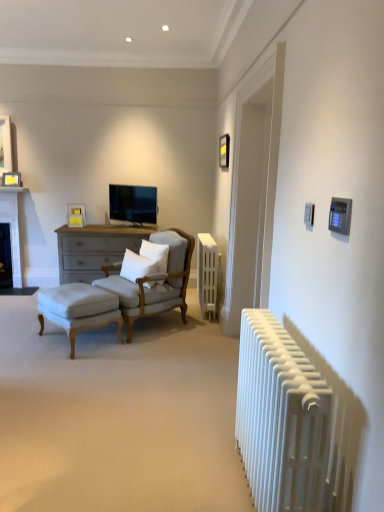
What do you see at coordinates (133, 204) in the screenshot? This screenshot has height=512, width=384. I see `matte black tv at center` at bounding box center [133, 204].

This screenshot has height=512, width=384. Find the location of `white fabric ottoman at lower left`. white fabric ottoman at lower left is located at coordinates (79, 309).

What is the approximate width of matte black picture frame at upper center, positioned as the first picture frame in top-to-bottom order?

1.90 inches.

Image resolution: width=384 pixels, height=512 pixels. What do you see at coordinates (224, 151) in the screenshot?
I see `matte black picture frame at upper center, arranged as the 3th picture frame when viewed from the left` at bounding box center [224, 151].

You are a GUI agent. You are given a task and a screenshot of the screen. Output one action in this format:
    pyautogui.click(x=<x>, y=<y>)
    Task: Click on the matte yellow picture frame at upper left, the 2th picture frame positioned from the bottom
    This screenshot has height=512, width=384.
    Given the screenshot: What is the action you would take?
    pyautogui.click(x=12, y=179)

This screenshot has width=384, height=512. What do you see at coordinates (14, 230) in the screenshot?
I see `white stone fireplace at left, arranged as the 2th fireplace when ordered from the bottom` at bounding box center [14, 230].

Consider the image. Measure the distance between point (145, 252) and camera.

4.01 meters.

What do you see at coordinates (156, 254) in the screenshot? The height and width of the screenshot is (512, 384). I see `white soft pillow at center, the first pillow in the right-to-left sequence` at bounding box center [156, 254].

Find the location of `matte black tv at center`. matte black tv at center is located at coordinates (133, 204).

Is white fabric ottoman at lower left looking in the opposite direction of light beige fabric armchair at center-left?

No, white fabric ottoman at lower left is not facing the opposite direction of light beige fabric armchair at center-left.

Can you confirm if white fabric ottoman at lower left is shorter than light beige fabric armchair at center-left?

Correct, white fabric ottoman at lower left is not as tall as light beige fabric armchair at center-left.

From the image's perspective, is white fabric ottoman at lower left above or below light beige fabric armchair at center-left?

Based on their image positions, white fabric ottoman at lower left is located beneath light beige fabric armchair at center-left.

Which object is thinner, white stone fireplace at left, the first fireplace from the top, or dark gray stone fireplace at left, placed as the 1th fireplace when sorted from bottom to top?

With smaller width is white stone fireplace at left, the first fireplace from the top.

Considering the relative positions of white stone fireplace at left, the first fireplace from the top, and dark gray stone fireplace at left, placed as the 1th fireplace when sorted from bottom to top, in the image provided, is white stone fireplace at left, the first fireplace from the top, to the left or to the right of dark gray stone fireplace at left, placed as the 1th fireplace when sorted from bottom to top,?

white stone fireplace at left, the first fireplace from the top, is to the right of dark gray stone fireplace at left, placed as the 1th fireplace when sorted from bottom to top.

Is white stone fireplace at left, arranged as the 2th fireplace when ordered from the bottom, outside of dark gray stone fireplace at left, placed as the 1th fireplace when sorted from bottom to top?

That's incorrect, white stone fireplace at left, arranged as the 2th fireplace when ordered from the bottom, is not completely outside dark gray stone fireplace at left, placed as the 1th fireplace when sorted from bottom to top.

Consider the image. Is white stone fireplace at left, the first fireplace from the top, beside dark gray stone fireplace at left, placed as the 1th fireplace when sorted from bottom to top?

No, white stone fireplace at left, the first fireplace from the top, is not making contact with dark gray stone fireplace at left, placed as the 1th fireplace when sorted from bottom to top.

From a real-world perspective, is light beige fabric armchair at center-left physically above white metallic radiator at center, which is counted as the 2th radiator, starting from the front?

Yes, from a real-world perspective, light beige fabric armchair at center-left is over white metallic radiator at center, which is counted as the 2th radiator, starting from the front

Which object is further away from the camera, light beige fabric armchair at center-left or white metallic radiator at center, which is counted as the 2th radiator, starting from the front?

white metallic radiator at center, which is counted as the 2th radiator, starting from the front, is more distant.

Which is correct: light beige fabric armchair at center-left is inside white metallic radiator at center, positioned as the 1th radiator in back-to-front order, or outside of it?

light beige fabric armchair at center-left is spatially situated outside white metallic radiator at center, positioned as the 1th radiator in back-to-front order.

Considering the relative sizes of light beige fabric armchair at center-left and white metallic radiator at center, positioned as the 1th radiator in back-to-front order, in the image provided, is light beige fabric armchair at center-left taller than white metallic radiator at center, positioned as the 1th radiator in back-to-front order,?

Yes.

Is point (135, 306) closer to camera compared to point (19, 172)?

That is True.

Considering the sizes of objects light beige fabric armchair at center-left and matte yellow picture frame at upper left, which is the 3th picture frame from right to left, in the image provided, who is shorter, light beige fabric armchair at center-left or matte yellow picture frame at upper left, which is the 3th picture frame from right to left,?

With less height is matte yellow picture frame at upper left, which is the 3th picture frame from right to left.

Can you tell me how much light beige fabric armchair at center-left and matte yellow picture frame at upper left, the second picture frame viewed from the front, differ in facing direction?

45.6 degrees.

Identify the location of the 2nd picture frame behind the light beige fabric armchair at center-left, counting from the anchor's position. (12, 179).

Is matte yellow picture frame at upper left, the 2th picture frame positioned from the bottom, in front of or behind white soft cushion at center, which is the first pillow in left-to-right order, in the image?

matte yellow picture frame at upper left, the 2th picture frame positioned from the bottom, is positioned farther from the viewer than white soft cushion at center, which is the first pillow in left-to-right order.

Find the location of a particular element. This screenshot has height=512, width=384. the 2nd picture frame behind the white soft cushion at center, which is the first pillow in left-to-right order is located at coordinates (12, 179).

Choose the correct answer: Is matte yellow picture frame at upper left, which is the 3th picture frame from right to left, inside white soft cushion at center, the second pillow positioned from the right, or outside it?

matte yellow picture frame at upper left, which is the 3th picture frame from right to left, is not inside white soft cushion at center, the second pillow positioned from the right, it's outside.

Is matte yellow picture frame at upper left, arranged as the second picture frame when viewed from the left, in front of white stone fireplace at left, arranged as the 2th fireplace when ordered from the bottom?

That is True.

Is white stone fireplace at left, arranged as the 2th fireplace when ordered from the bottom, located within matte yellow picture frame at upper left, the 1th picture frame from the back?

That's incorrect, white stone fireplace at left, arranged as the 2th fireplace when ordered from the bottom, is not inside matte yellow picture frame at upper left, the 1th picture frame from the back.

The height and width of the screenshot is (512, 384). Identify the location of the 1st fireplace to the left when counting from the matte yellow picture frame at upper left, acting as the first picture frame starting from the bottom. (14, 230).

Considering the relative sizes of matte yellow picture frame at upper left, which is the 3th picture frame from right to left, and light beige fabric armchair at center-left in the image provided, is matte yellow picture frame at upper left, which is the 3th picture frame from right to left, shorter than light beige fabric armchair at center-left?

Correct, matte yellow picture frame at upper left, which is the 3th picture frame from right to left, is not as tall as light beige fabric armchair at center-left.

Considering the sizes of objects matte yellow picture frame at upper left, which is the 3th picture frame from right to left, and light beige fabric armchair at center-left in the image provided, who is wider, matte yellow picture frame at upper left, which is the 3th picture frame from right to left, or light beige fabric armchair at center-left?

With larger width is light beige fabric armchair at center-left.

Is matte yellow picture frame at upper left, which is the 3th picture frame from right to left, further to camera compared to light beige fabric armchair at center-left?

Yes, matte yellow picture frame at upper left, which is the 3th picture frame from right to left, is behind light beige fabric armchair at center-left.

Is there a large distance between matte yellow picture frame at upper left, the 2th picture frame viewed from the back, and light beige fabric armchair at center-left?

Absolutely, matte yellow picture frame at upper left, the 2th picture frame viewed from the back, is distant from light beige fabric armchair at center-left.

At what (x,y) coordinates should I click in order to perform the action: click on chair that appears above the white fabric ottoman at lower left (from a real-world perspective). Please return your answer as a coordinate pair (x, y). Looking at the image, I should click on (156, 284).

Locate an element on the screen. Image resolution: width=384 pixels, height=512 pixels. fireplace on the right of dark gray stone fireplace at left, acting as the 2th fireplace starting from the top is located at coordinates (14, 230).

Which object lies further to the anchor point matte black picture frame at upper center, the third picture frame from the back, white fabric ottoman at lower left or light beige fabric armchair at center-left?

white fabric ottoman at lower left.

From the image, which object appears to be farther from white stone fireplace at left, the first fireplace from the top, white soft pillow at center, the first pillow in the right-to-left sequence, or matte yellow picture frame at upper left, the 2th picture frame viewed from the top?

Among the two, white soft pillow at center, the first pillow in the right-to-left sequence, is located further to white stone fireplace at left, the first fireplace from the top.

Estimate the real-world distances between objects in this image. Which object is closer to white stone fireplace at left, arranged as the 2th fireplace when ordered from the bottom, light beige fabric armchair at center-left or white fabric ottoman at lower left?

white fabric ottoman at lower left is positioned closer to the anchor white stone fireplace at left, arranged as the 2th fireplace when ordered from the bottom.

In the scene shown: When comparing their distances from white metallic radiator at right, which is counted as the 2th radiator, starting from the back, does matte black picture frame at upper center, the third picture frame when ordered from bottom to top, or dark gray stone fireplace at left, acting as the 2th fireplace starting from the top, seem closer?

The object closer to white metallic radiator at right, which is counted as the 2th radiator, starting from the back, is matte black picture frame at upper center, the third picture frame when ordered from bottom to top.

Based on their spatial positions, is white stone fireplace at left, arranged as the 2th fireplace when ordered from the bottom, or white soft cushion at center, the second pillow positioned from the right, further from white metallic radiator at center, positioned as the 1th radiator in back-to-front order?

white stone fireplace at left, arranged as the 2th fireplace when ordered from the bottom, is further to white metallic radiator at center, positioned as the 1th radiator in back-to-front order.

Based on their spatial positions, is matte yellow picture frame at upper left, arranged as the second picture frame when viewed from the left, or white metallic radiator at center, which is counted as the 2th radiator, starting from the front, further from white stone fireplace at left, arranged as the 2th fireplace when ordered from the bottom?

white metallic radiator at center, which is counted as the 2th radiator, starting from the front, is further to white stone fireplace at left, arranged as the 2th fireplace when ordered from the bottom.

Based on their spatial positions, is dark gray stone fireplace at left, acting as the 2th fireplace starting from the top, or light beige fabric armchair at center-left further from matte black picture frame at upper center, which ranks as the 1th picture frame in right-to-left order?

dark gray stone fireplace at left, acting as the 2th fireplace starting from the top, is further to matte black picture frame at upper center, which ranks as the 1th picture frame in right-to-left order.

Considering their positions, is white metallic radiator at right, the 1th radiator from the front, positioned further to light beige fabric armchair at center-left than white fabric ottoman at lower left?

white metallic radiator at right, the 1th radiator from the front, is positioned further to the anchor light beige fabric armchair at center-left.

This screenshot has width=384, height=512. What are the coordinates of `chair located between white stone fireplace at left, arranged as the 2th fireplace when ordered from the bottom, and matte black picture frame at upper center, arranged as the 3th picture frame when viewed from the left, in the left-right direction` in the screenshot? It's located at (156, 284).

In order to click on chair positioned between white metallic radiator at right, the 1th radiator from the front, and matte yellow picture frame at upper left, acting as the first picture frame starting from the bottom, from near to far in this screenshot , I will do `click(156, 284)`.

Image resolution: width=384 pixels, height=512 pixels. Identify the location of television that lies between matte black picture frame at upper center, arranged as the 3th picture frame when viewed from the left, and white soft pillow at center, the first pillow in the right-to-left sequence, from top to bottom. tap(133, 204).

You are a GUI agent. You are given a task and a screenshot of the screen. Output one action in this format:
    pyautogui.click(x=<x>, y=<y>)
    Task: Click on the television between matte black picture frame at upper center, marked as the 1th picture frame in a front-to-back arrangement, and light beige fabric armchair at center-left, in the vertical direction
    
    Given the screenshot: What is the action you would take?
    (x=133, y=204)